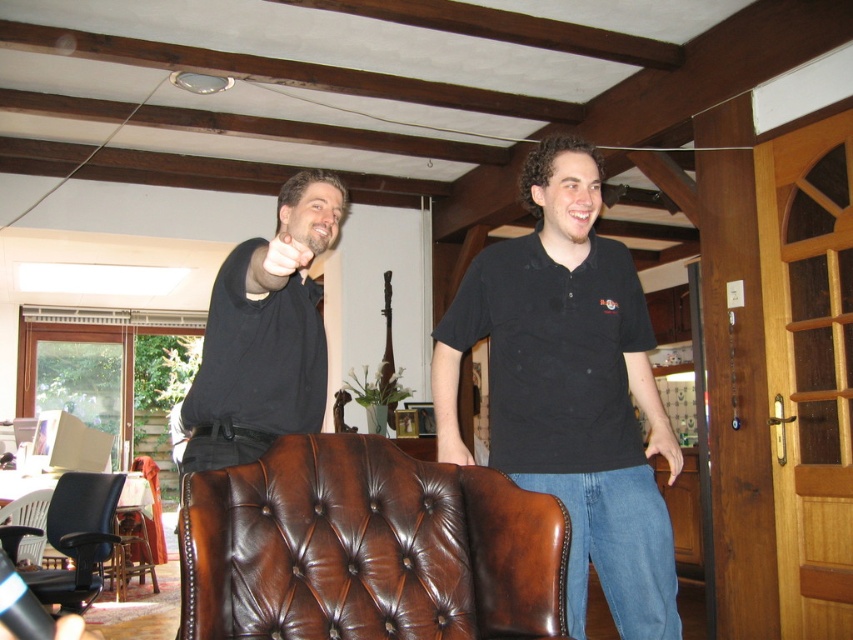
Question: Does brown leather armchair at center come behind black cotton shirt at center?

Choices:
 (A) yes
 (B) no

Answer: (B)

Question: Observing the image, what is the correct spatial positioning of black cotton shirt at center in reference to brown leather armchair at lower left?

Choices:
 (A) left
 (B) right

Answer: (B)

Question: Which point is closer to the camera?

Choices:
 (A) black cotton shirt at center
 (B) black leather shirt at center

Answer: (B)

Question: Is black cotton shirt at center to the left of black leather shirt at center from the viewer's perspective?

Choices:
 (A) yes
 (B) no

Answer: (B)

Question: Which point is farther from the camera taking this photo?

Choices:
 (A) (575, 611)
 (B) (308, 577)
 (C) (511, 317)

Answer: (C)

Question: Which point is closer to the camera taking this photo?

Choices:
 (A) (318, 172)
 (B) (666, 544)

Answer: (B)